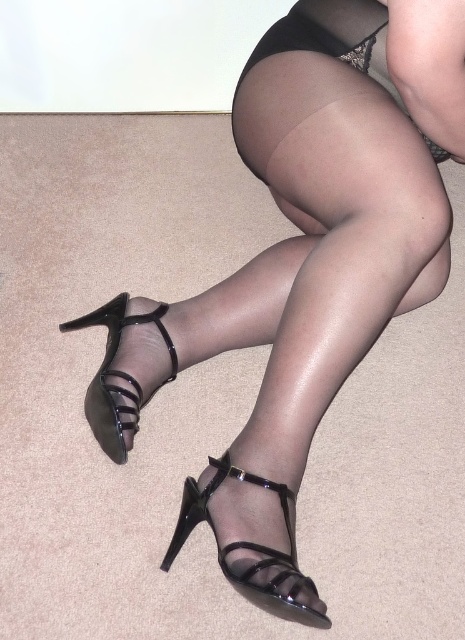
What do you see at coordinates (250, 547) in the screenshot? The width and height of the screenshot is (465, 640). I see `black patent leather sandal at lower center` at bounding box center [250, 547].

In the scene shown: Is black patent leather sandal at lower center shorter than black patent leather high-heeled sandal at lower left?

Yes.

Describe the element at coordinates (250, 547) in the screenshot. I see `black patent leather sandal at lower center` at that location.

You are a GUI agent. You are given a task and a screenshot of the screen. Output one action in this format:
    pyautogui.click(x=<x>, y=<y>)
    Task: Click on the black patent leather sandal at lower center
    The height and width of the screenshot is (640, 465).
    Given the screenshot: What is the action you would take?
    pyautogui.click(x=250, y=547)

Could you measure the distance between black patent leather sandal at lower center and black sheer dress at upper center?

black patent leather sandal at lower center is 28.07 inches from black sheer dress at upper center.

Is point (268, 557) less distant than point (279, 40)?

Yes, point (268, 557) is in front of point (279, 40).

Which is behind, point (241, 580) or point (379, 24)?

Positioned behind is point (379, 24).

I want to click on black patent leather sandal at lower center, so click(250, 547).

Is black patent leather high-heeled sandal at lower left taller than black sheer dress at upper center?

Incorrect, black patent leather high-heeled sandal at lower left's height is not larger of black sheer dress at upper center's.

Which of these two, black patent leather high-heeled sandal at lower left or black sheer dress at upper center, stands taller?

black sheer dress at upper center is taller.

Locate an element on the screen. black patent leather high-heeled sandal at lower left is located at coordinates (118, 376).